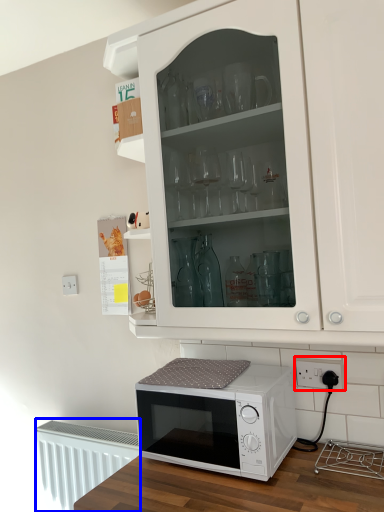
Question: Which object appears farthest to the camera in this image, electric outlet (highlighted by a red box) or radiator (highlighted by a blue box)?

Choices:
 (A) electric outlet
 (B) radiator

Answer: (B)